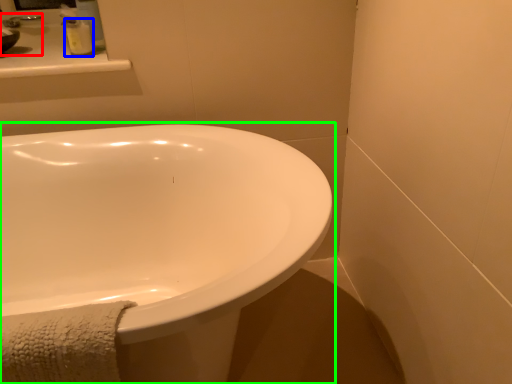
Question: Based on their relative distances, which object is nearer to sink (highlighted by a red box)? Choose from soap dispenser (highlighted by a blue box) and bathtub (highlighted by a green box).

Choices:
 (A) soap dispenser
 (B) bathtub

Answer: (A)